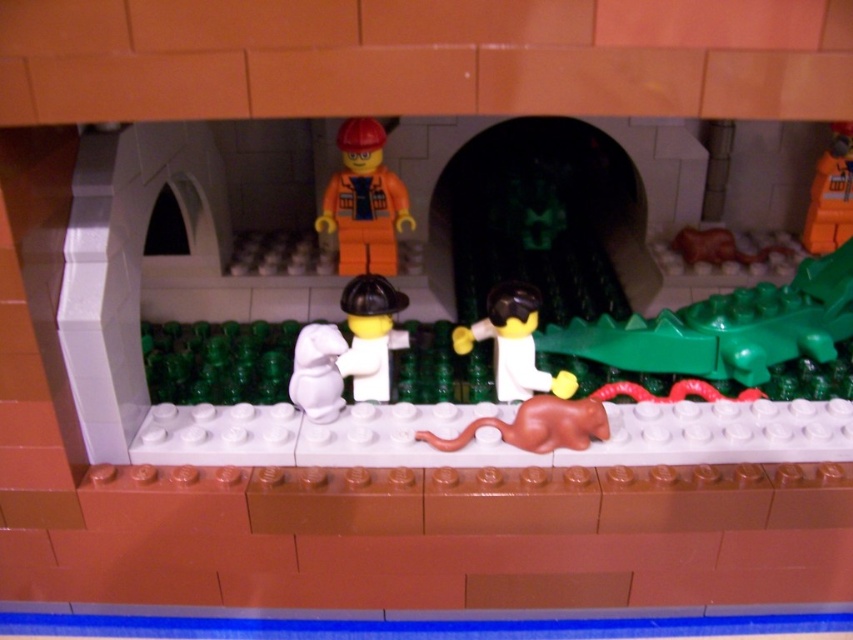
Between point (352, 372) and point (846, 227), which one is positioned behind?

Point (846, 227)

Can you confirm if white matte minifigure at center is taller than orange plastic toy at center?

Incorrect, white matte minifigure at center's height is not larger of orange plastic toy at center's.

In order to click on white matte minifigure at center in this screenshot , I will do `click(370, 333)`.

Who is more distant from viewer, (x=335, y=374) or (x=714, y=260)?

Point (x=714, y=260)

How distant is white matte mouse at center from brown rubber snake at right?

91.79 centimeters

What do you see at coordinates (317, 372) in the screenshot? Image resolution: width=853 pixels, height=640 pixels. I see `white matte mouse at center` at bounding box center [317, 372].

In order to click on white matte mouse at center in this screenshot , I will do `click(317, 372)`.

Find the location of a particular element. This screenshot has width=853, height=640. orange matte construction worker at center is located at coordinates (364, 202).

From the picture: Does orange matte construction worker at center have a larger size compared to orange plastic toy at center?

Yes.

Between point (363, 241) and point (849, 186), which one is positioned in front?

Positioned in front is point (363, 241).

In order to click on orange matte construction worker at center in this screenshot , I will do `click(364, 202)`.